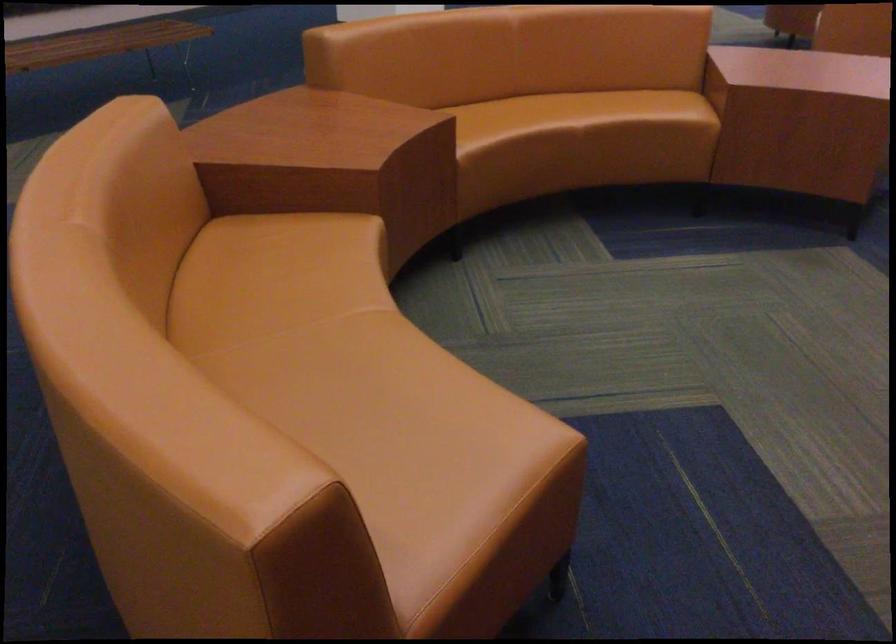
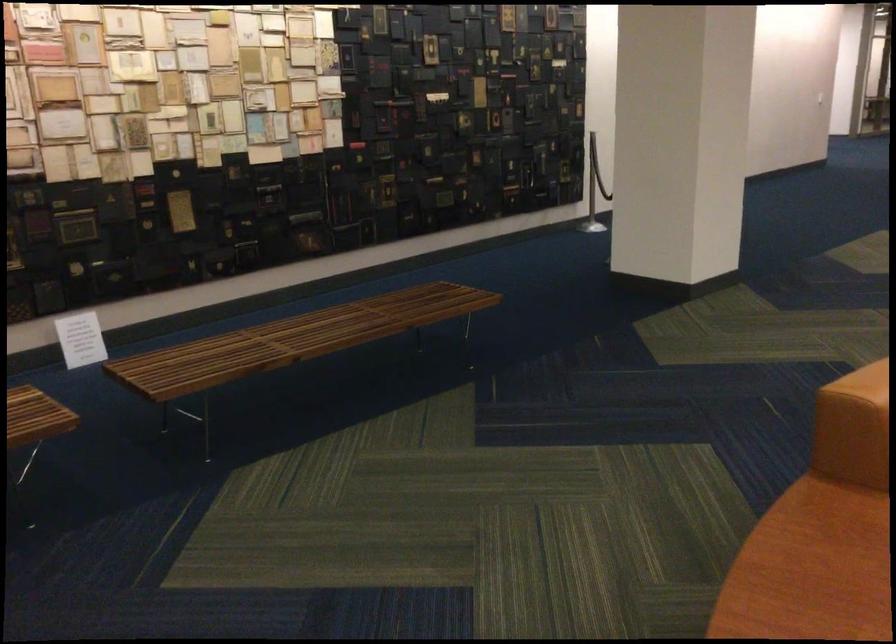
In a continuous first-person perspective shot, in which direction is the camera moving?

The movement direction of the cameraman is left, forward.